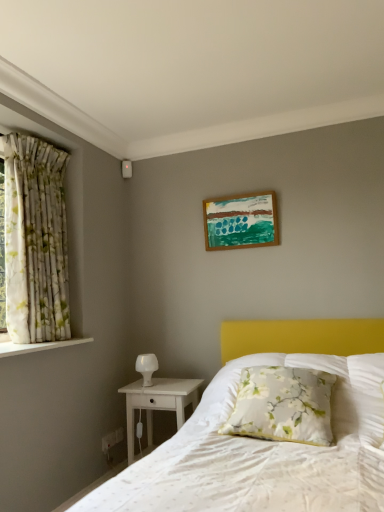
At what (x,y) coordinates should I click in order to perform the action: click on vacant area located to the right-hand side of white frosted glass table lamp at lower left. Please return your answer as a coordinate pair (x, y). This screenshot has width=384, height=512. Looking at the image, I should click on (180, 384).